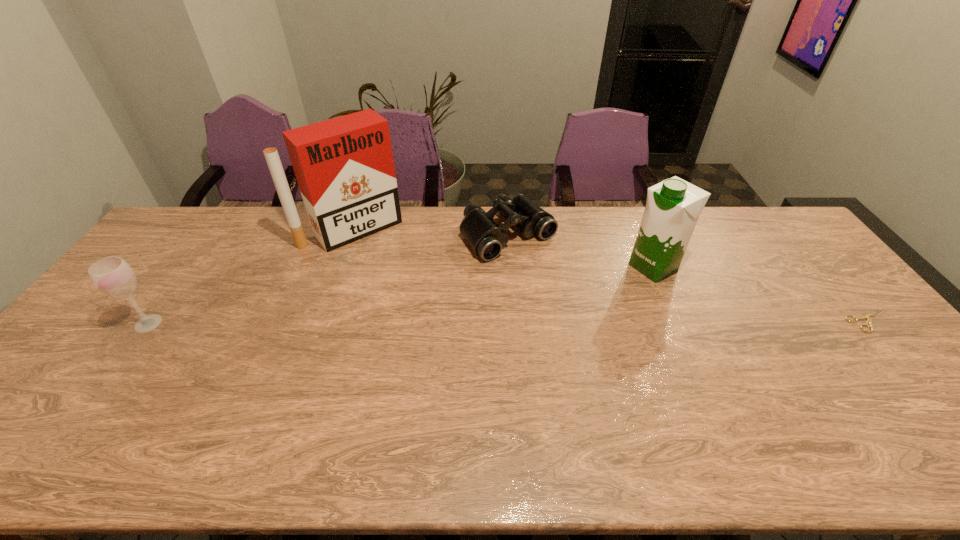
Where is `vacant space positioned on the front-facing side of the second object from left to right`? vacant space positioned on the front-facing side of the second object from left to right is located at coordinates (398, 272).

The height and width of the screenshot is (540, 960). I want to click on binoculars positioned at the far edge, so click(486, 238).

Locate an element on the screen. Image resolution: width=960 pixels, height=540 pixels. cigarette case present at the far edge is located at coordinates (344, 166).

Identify the location of object positioned at the left edge. (113, 276).

Identify the location of object that is at the right edge. Image resolution: width=960 pixels, height=540 pixels. (868, 320).

You are a GUI agent. You are given a task and a screenshot of the screen. Output one action in this format:
    pyautogui.click(x=<x>, y=<y>)
    Task: Click on the vacant space at the far edge
    
    Given the screenshot: What is the action you would take?
    pyautogui.click(x=426, y=215)

Find the location of `vacant space at the near edge of the desktop`. vacant space at the near edge of the desktop is located at coordinates (222, 395).

In the image, there is a desktop. What are the coordinates of `free space at the left edge` in the screenshot? It's located at (124, 335).

You are a GUI agent. You are given a task and a screenshot of the screen. Output one action in this format:
    pyautogui.click(x=<x>, y=<y>)
    Task: Click on the free space at the right edge
    
    Given the screenshot: What is the action you would take?
    pyautogui.click(x=776, y=261)

At what (x,y) coordinates should I click in order to perform the action: click on free space at the far left corner of the desktop. Please return your answer as a coordinate pair (x, y). Image resolution: width=960 pixels, height=540 pixels. Looking at the image, I should click on (178, 241).